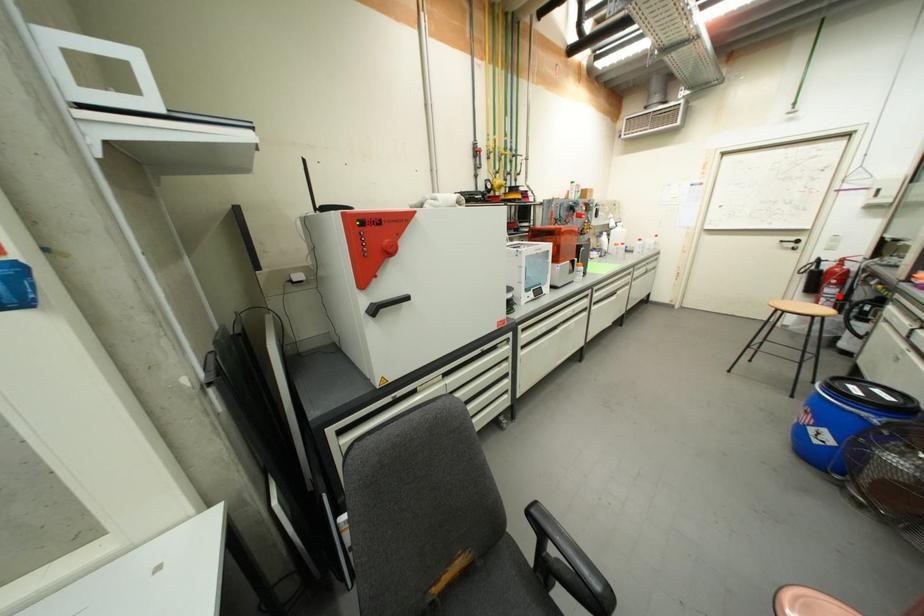
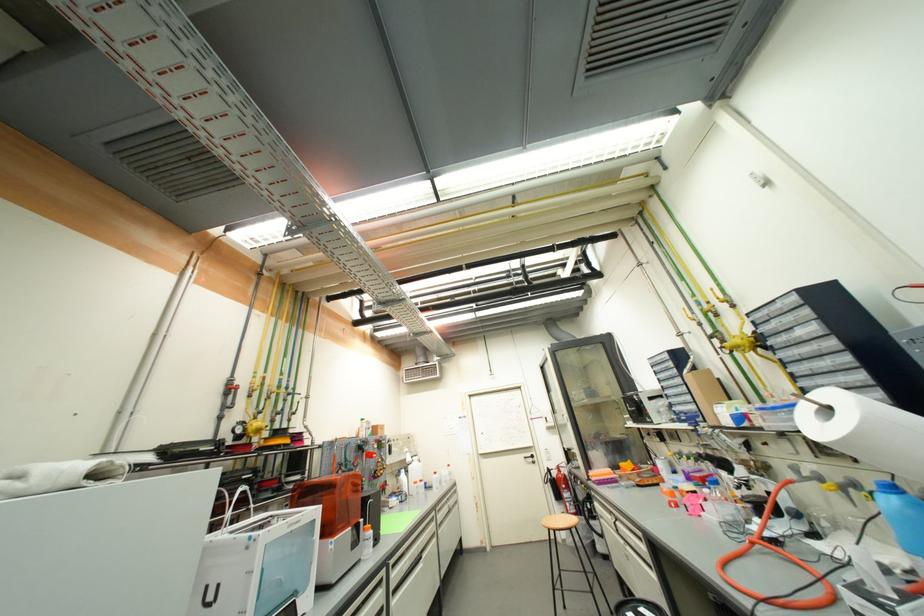
Question: I am providing you with two images of the same scene from different viewpoints. A red point is marked on the first image. At the location where the point appears in image 1, is it still visible in image 2?

Choices:
 (A) Yes
 (B) No

Answer: (A)